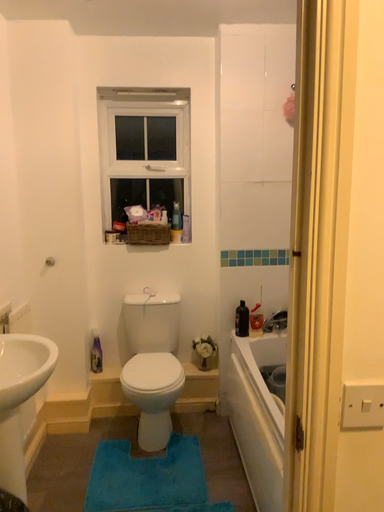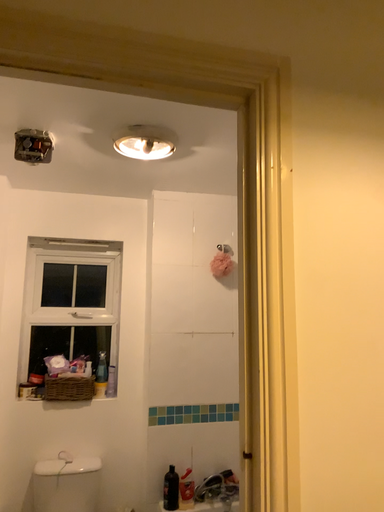
Question: How did the camera likely rotate when shooting the video?

Choices:
 (A) rotated upward
 (B) rotated downward

Answer: (A)